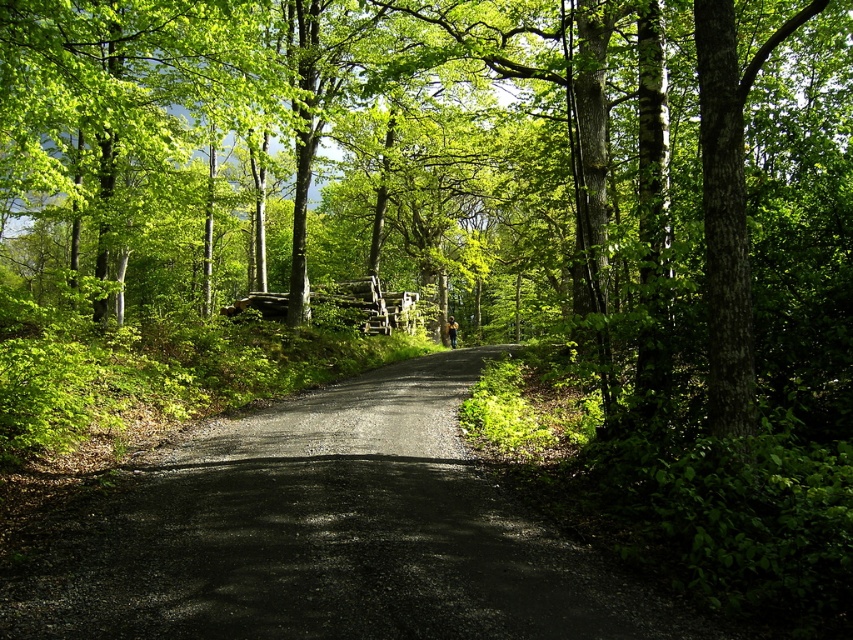
Is green leafy tree at center thinner than dirt/gravel road at center?

Incorrect, green leafy tree at center's width is not less than dirt/gravel road at center's.

At what (x,y) coordinates should I click in order to perform the action: click on green leafy tree at center. Please return your answer as a coordinate pair (x, y). Looking at the image, I should click on (430, 196).